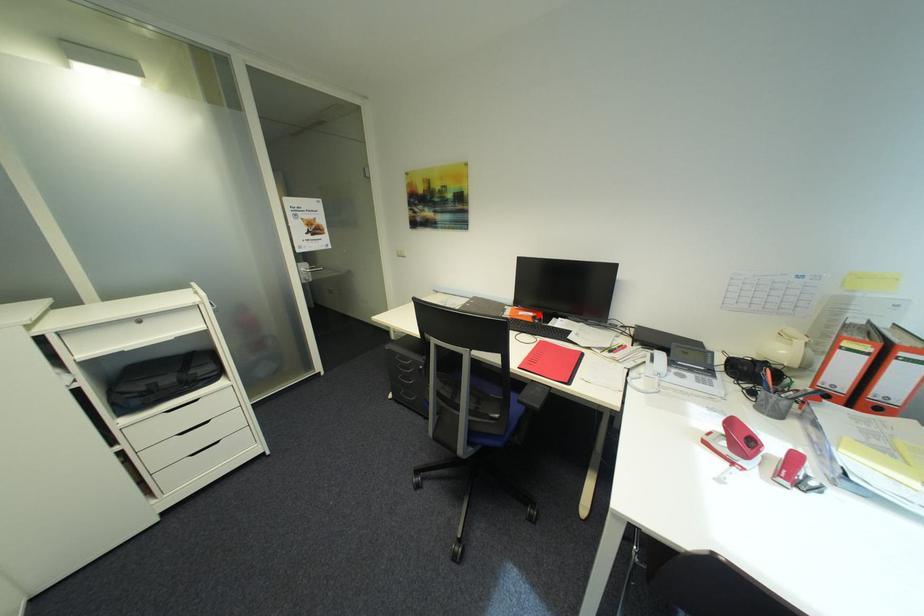
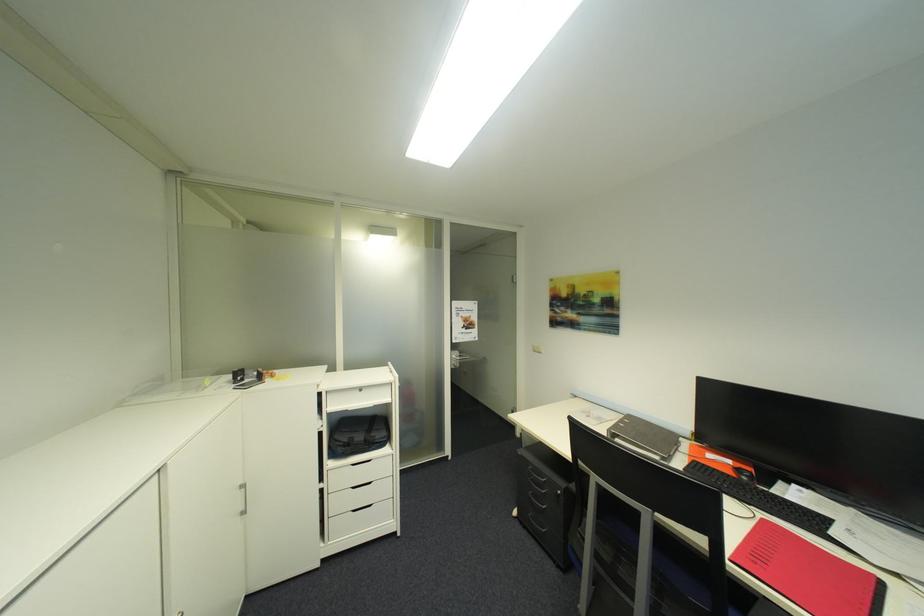
Where in the second image is the point corresponding to the highlighted location from the first image?

(736, 463)